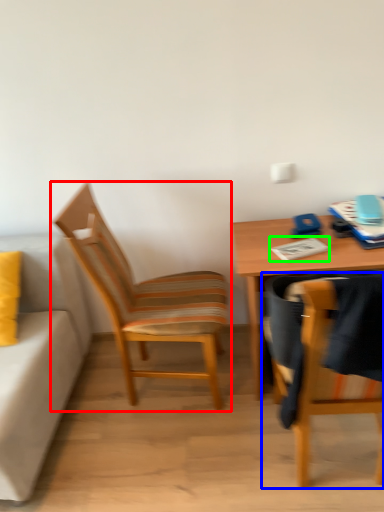
Question: Estimate the real-world distances between objects in this image. Which object is farther from chair (highlighted by a red box), chair (highlighted by a blue box) or notepad (highlighted by a green box)?

Choices:
 (A) chair
 (B) notepad

Answer: (A)